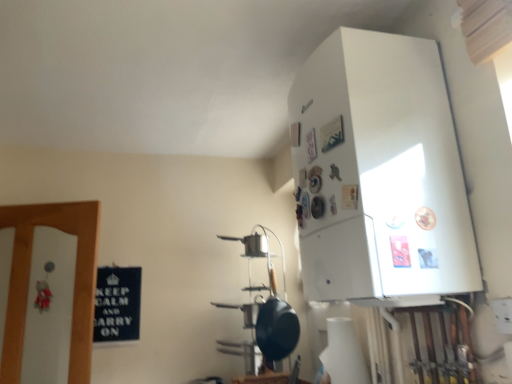
This screenshot has width=512, height=384. I want to click on white glossy refrigerator at upper right, so click(x=380, y=172).

The height and width of the screenshot is (384, 512). What do you see at coordinates (380, 172) in the screenshot?
I see `white glossy refrigerator at upper right` at bounding box center [380, 172].

The image size is (512, 384). What do you see at coordinates (276, 325) in the screenshot?
I see `black matte wok at center` at bounding box center [276, 325].

This screenshot has width=512, height=384. In order to click on black matte wok at center in this screenshot , I will do `click(276, 325)`.

What is the approximate width of black matte wok at center?

black matte wok at center is 12.35 inches in width.

Identify the location of white glossy refrigerator at upper right. This screenshot has height=384, width=512. (380, 172).

Can you confirm if black matte wok at center is positioned to the right of white glossy refrigerator at upper right?

Incorrect, black matte wok at center is not on the right side of white glossy refrigerator at upper right.

In the scene shown: Which object is further away from the camera taking this photo, black matte wok at center or white glossy refrigerator at upper right?

black matte wok at center is further from the camera.

Which is nearer, (285, 315) or (367, 149)?

The point (367, 149) is more forward.

From the image's perspective, is black matte wok at center positioned above or below white glossy refrigerator at upper right?

From the image's perspective, black matte wok at center appears below white glossy refrigerator at upper right.

From a real-world perspective, is black matte wok at center positioned above or below white glossy refrigerator at upper right?

black matte wok at center is situated lower than white glossy refrigerator at upper right in the real world.

From the picture: Looking at their sizes, would you say black matte wok at center is wider or thinner than white glossy refrigerator at upper right?

In the image, black matte wok at center appears to be more narrow than white glossy refrigerator at upper right.

Does black matte wok at center have a greater height compared to white glossy refrigerator at upper right?

In fact, black matte wok at center may be shorter than white glossy refrigerator at upper right.

Is black matte wok at center smaller than white glossy refrigerator at upper right?

Yes.

Is white glossy refrigerator at upper right completely or partially inside black matte wok at center?

No, white glossy refrigerator at upper right is not a part of black matte wok at center.

Does black matte wok at center touch white glossy refrigerator at upper right?

There is a gap between black matte wok at center and white glossy refrigerator at upper right.

Is black matte wok at center oriented away from white glossy refrigerator at upper right?

black matte wok at center is not turned away from white glossy refrigerator at upper right.

Can you tell me how much black matte wok at center and white glossy refrigerator at upper right differ in facing direction?

The angular difference between black matte wok at center and white glossy refrigerator at upper right is 22.4 degrees.

The height and width of the screenshot is (384, 512). In order to click on wok behind the white glossy refrigerator at upper right in this screenshot , I will do `click(276, 325)`.

Is white glossy refrigerator at upper right to the left of black matte wok at center from the viewer's perspective?

No.

Does white glossy refrigerator at upper right come behind black matte wok at center?

That is False.

Does point (412, 157) appear closer or farther from the camera than point (262, 320)?

Clearly, point (412, 157) is closer to the camera than point (262, 320).

From the image's perspective, which one is positioned higher, white glossy refrigerator at upper right or black matte wok at center?

white glossy refrigerator at upper right is shown above in the image.

From a real-world perspective, is white glossy refrigerator at upper right located higher than black matte wok at center?

Yes, from a real-world perspective, white glossy refrigerator at upper right is on top of black matte wok at center.

Does white glossy refrigerator at upper right have a lesser width compared to black matte wok at center?

No.

Considering the relative sizes of white glossy refrigerator at upper right and black matte wok at center in the image provided, is white glossy refrigerator at upper right taller than black matte wok at center?

Correct, white glossy refrigerator at upper right is much taller as black matte wok at center.

Does white glossy refrigerator at upper right have a smaller size compared to black matte wok at center?

No.

Does white glossy refrigerator at upper right contain black matte wok at center?

No.

Does white glossy refrigerator at upper right touch black matte wok at center?

No, white glossy refrigerator at upper right is not beside black matte wok at center.

Could you tell me if white glossy refrigerator at upper right is facing black matte wok at center?

No, white glossy refrigerator at upper right is not aimed at black matte wok at center.

Measure the distance from white glossy refrigerator at upper right to black matte wok at center.

A distance of 1.11 meters exists between white glossy refrigerator at upper right and black matte wok at center.

The width and height of the screenshot is (512, 384). In order to click on wok on the left of white glossy refrigerator at upper right in this screenshot , I will do `click(276, 325)`.

Locate an element on the screen. This screenshot has width=512, height=384. wok below the white glossy refrigerator at upper right (from the image's perspective) is located at coordinates (276, 325).

Locate an element on the screen. appliance located above the black matte wok at center (from the image's perspective) is located at coordinates (380, 172).